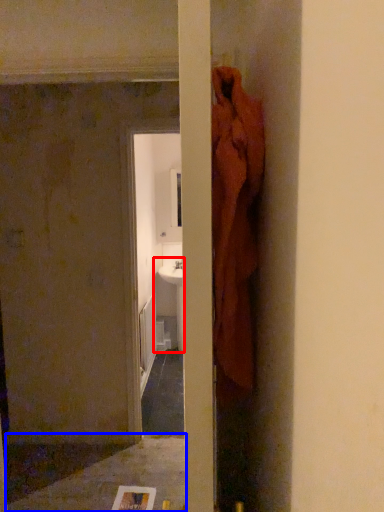
Question: Among these objects, which one is nearest to the camera, sink (highlighted by a red box) or concrete (highlighted by a blue box)?

Choices:
 (A) sink
 (B) concrete

Answer: (B)